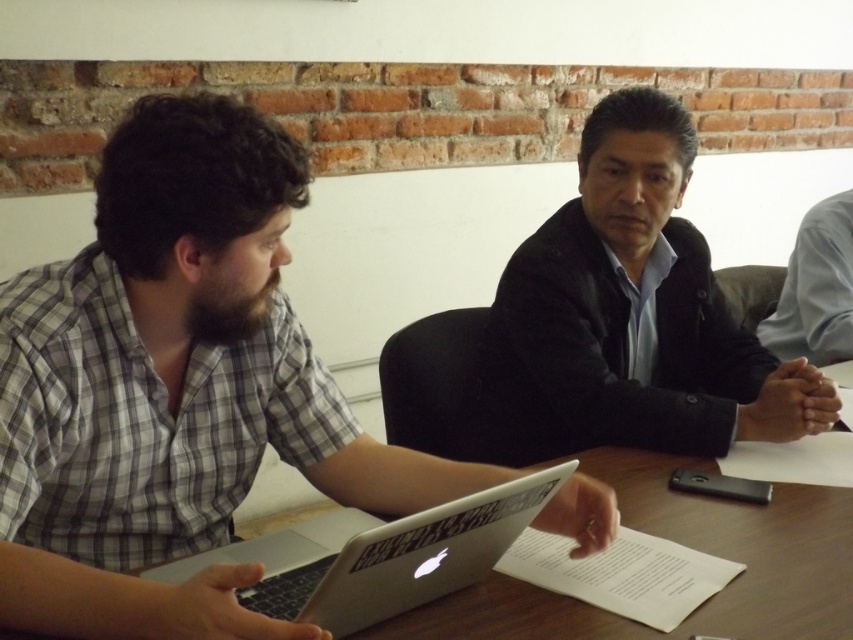
Question: Among these points, which one is farthest from the camera?

Choices:
 (A) click(x=372, y=561)
 (B) click(x=33, y=492)

Answer: (B)

Question: Does matte black laptop at left have a lesser width compared to black leather jacket at center?

Choices:
 (A) yes
 (B) no

Answer: (B)

Question: Is matte black laptop at left positioned behind black leather jacket at center?

Choices:
 (A) yes
 (B) no

Answer: (B)

Question: Estimate the real-world distances between objects in this image. Which object is closer to the matte black laptop at left?

Choices:
 (A) black leather jacket at center
 (B) silver metallic laptop at center

Answer: (B)

Question: Estimate the real-world distances between objects in this image. Which object is farther from the matte black laptop at left?

Choices:
 (A) silver metallic laptop at center
 (B) black leather jacket at center

Answer: (B)

Question: Can you confirm if matte black laptop at left is wider than silver metallic laptop at center?

Choices:
 (A) yes
 (B) no

Answer: (A)